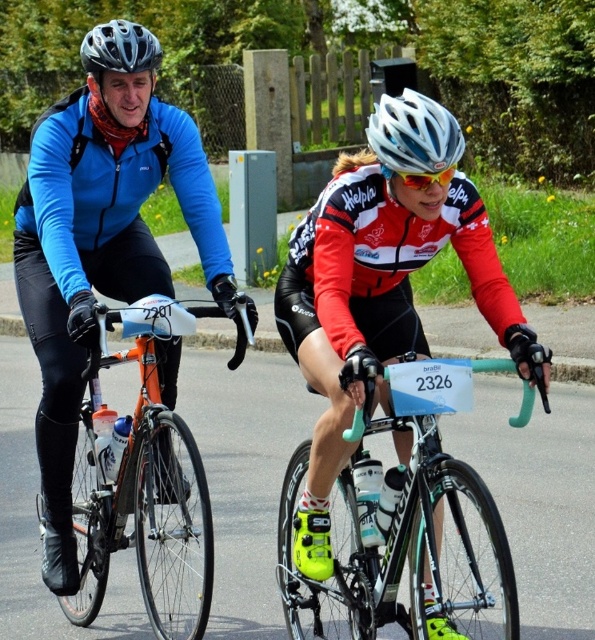
Question: Estimate the real-world distances between objects in this image. Which object is farther from the orange matte bicycle at left?

Choices:
 (A) matte black helmet at upper left
 (B) teal glossy bicycle at center
 (C) white matte bicycle helmet at center

Answer: (C)

Question: Which of these objects is positioned closest to the orange matte bicycle at left?

Choices:
 (A) teal glossy bicycle at center
 (B) matte black helmet at upper left
 (C) white matte bicycle helmet at center

Answer: (A)

Question: Can you confirm if orange matte bicycle at left is positioned above white matte bicycle helmet at center?

Choices:
 (A) no
 (B) yes

Answer: (A)

Question: Is orange matte bicycle at left wider than matte black helmet at upper left?

Choices:
 (A) no
 (B) yes

Answer: (A)

Question: Which point is farther to the camera?

Choices:
 (A) (148, 35)
 (B) (433, 100)

Answer: (B)

Question: Is orange matte bicycle at left positioned behind matte black helmet at upper left?

Choices:
 (A) yes
 (B) no

Answer: (B)